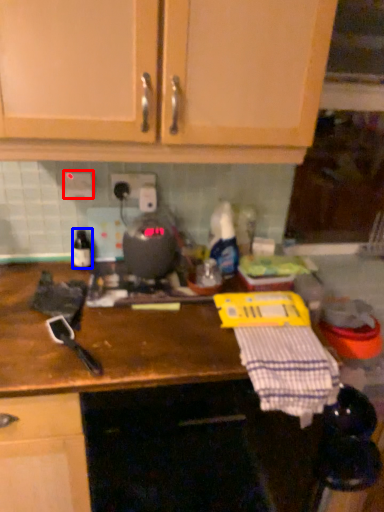
Question: Among these objects, which one is nearest to the camera, electric outlet (highlighted by a red box) or bottle (highlighted by a blue box)?

Choices:
 (A) electric outlet
 (B) bottle

Answer: (A)